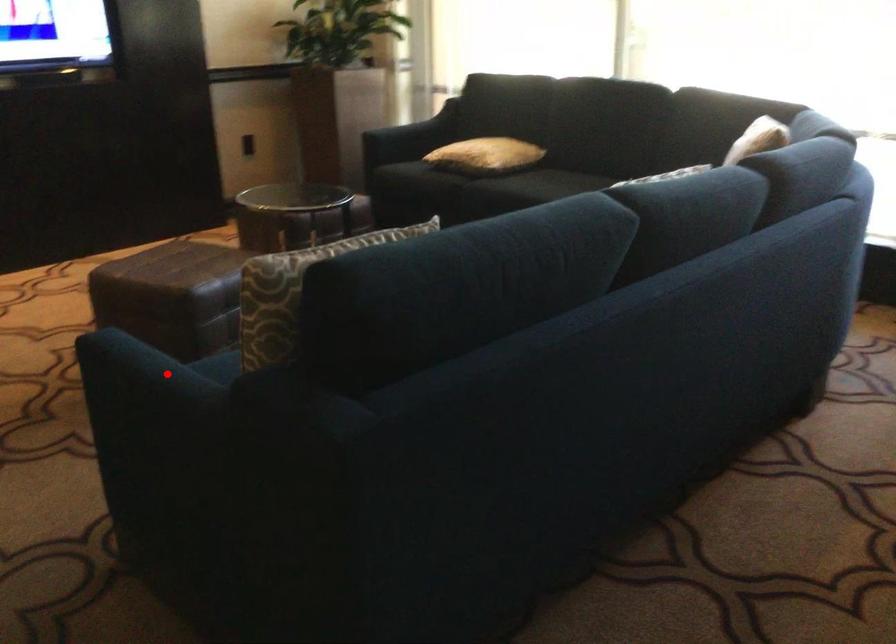
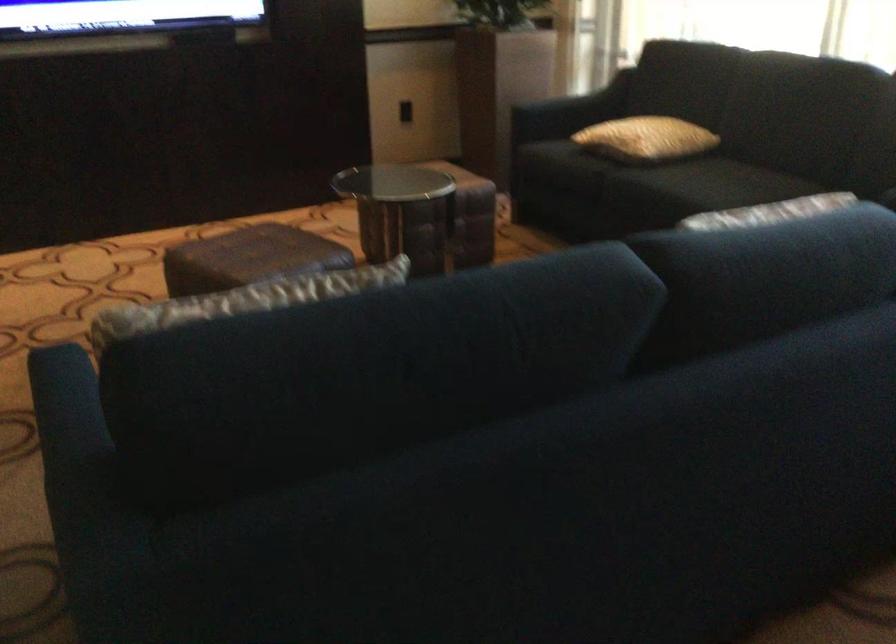
In the second image, find the point that corresponds to the highlighted location in the first image.

(69, 431)